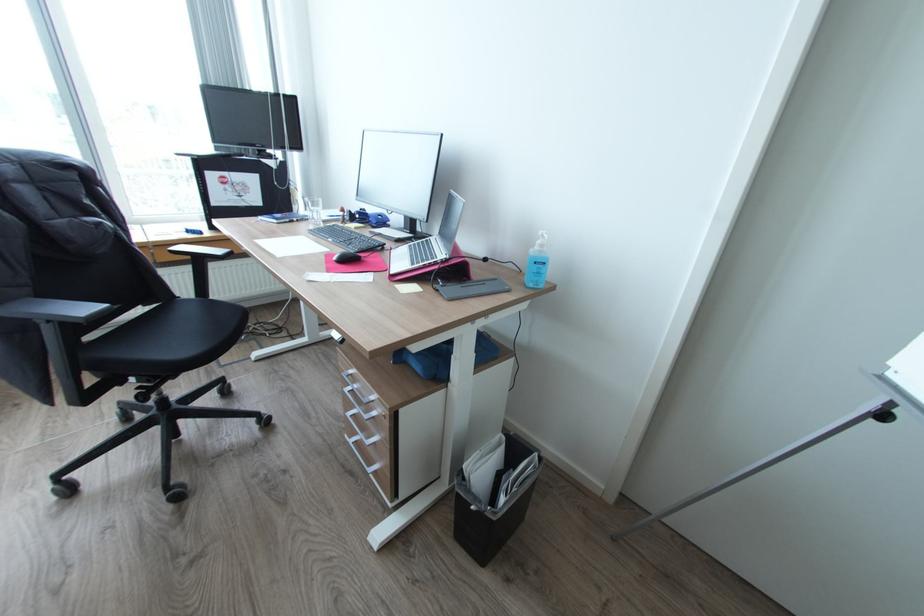
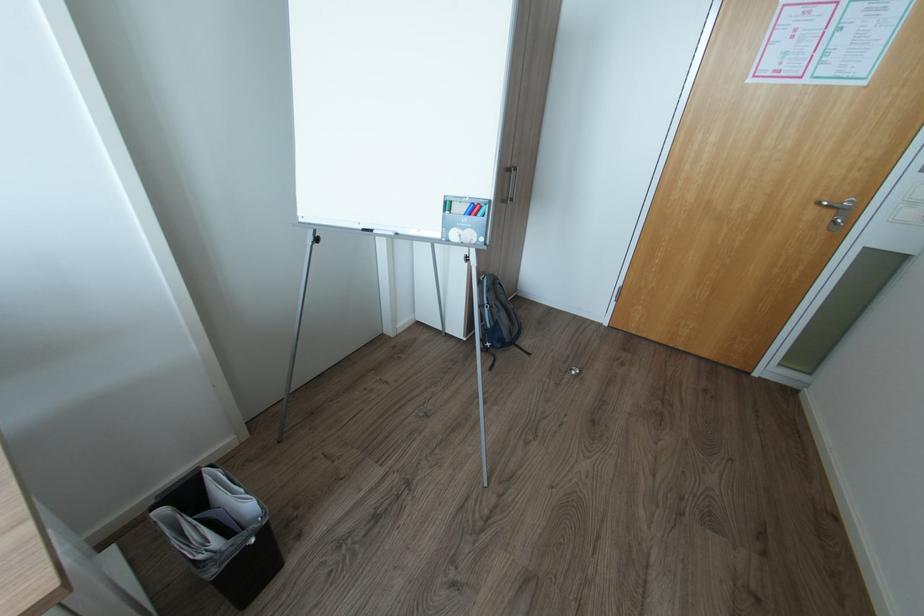
Find the pixel in the second image that matches (477,507) in the first image.

(257, 541)